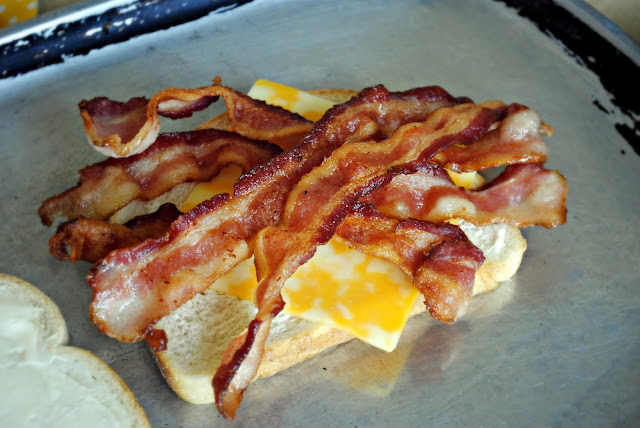
Where is `yellow and white polka dots box`? This screenshot has width=640, height=428. yellow and white polka dots box is located at coordinates (17, 8).